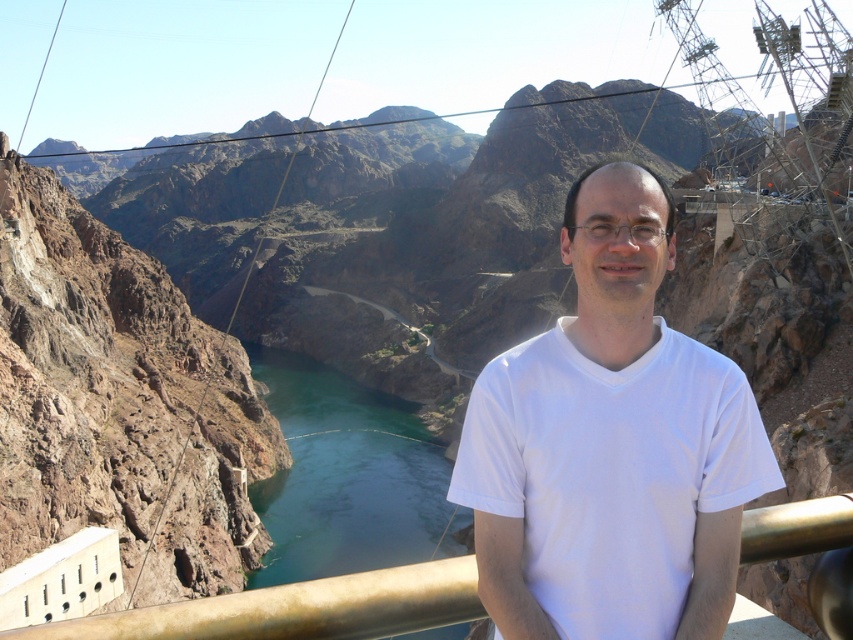
Question: Which point appears closest to the camera in this image?

Choices:
 (A) (689, 348)
 (B) (793, 541)
 (C) (363, 547)

Answer: (B)

Question: Based on their relative distances, which object is nearer to the gold metallic railing at center?

Choices:
 (A) white matte shirt at center
 (B) green smooth water at center

Answer: (A)

Question: Does green smooth water at center appear under gold metallic railing at center?

Choices:
 (A) yes
 (B) no

Answer: (A)

Question: Does white matte shirt at center appear under gold metallic railing at center?

Choices:
 (A) yes
 (B) no

Answer: (B)

Question: Which point is farther to the camera?

Choices:
 (A) (433, 513)
 (B) (404, 611)

Answer: (A)

Question: Where is white matte shirt at center located in relation to gold metallic railing at center in the image?

Choices:
 (A) left
 (B) right

Answer: (B)